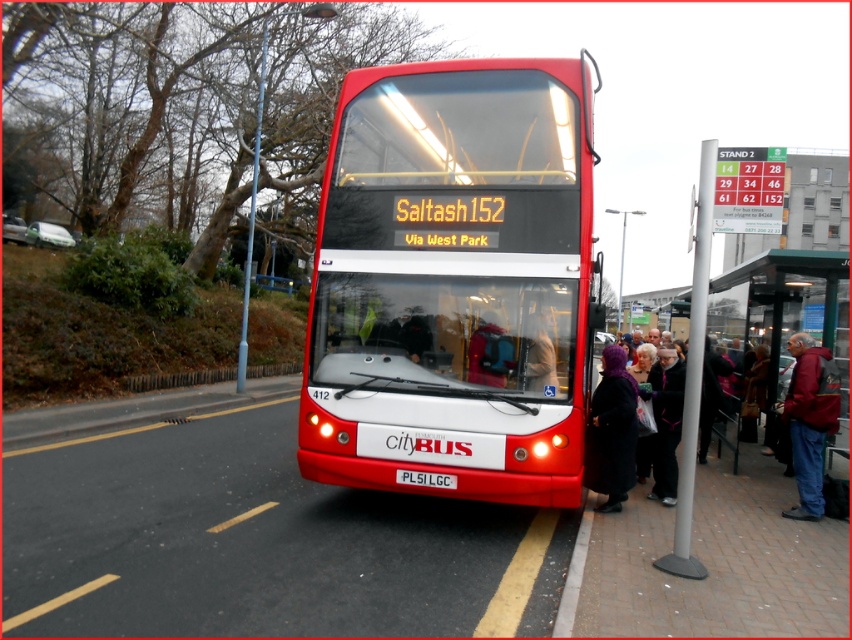
You are waiting at the bus stop and want to know if the shiny red bus at center will block the view of the metallic pole at center right when it departs. Based on their heights, can you determine if the pole will still be visible after the bus moves away?

The shiny red bus at center is not as tall as the metallic pole at center right, so when the bus departs, the pole will still be visible as it is taller than the bus.

In the scene shown: You are a bus driver approaching the bus stop and need to park your bus at STAND 2. There is a metallic pole at center right marked by point (x=694, y=369). Where should you position your bus relative to the pole to ensure it is correctly parked at STAND 2?

The metallic pole at center right marked by point (x=694, y=369) is located to the right of STAND 2. Therefore, you should position your bus to the left of the pole to ensure correct parking at STAND 2.

You are a traveler at the bus stop and want to place your red leather jacket at lower right and velvet purple scarf at lower center into a narrow bag. The bag can only hold items thinner than 5 cm. Which item can you put in the bag?

The red leather jacket at lower right is thinner than velvet purple scarf at lower center, so you can put the red leather jacket at lower right into the bag since it meets the thickness requirement.